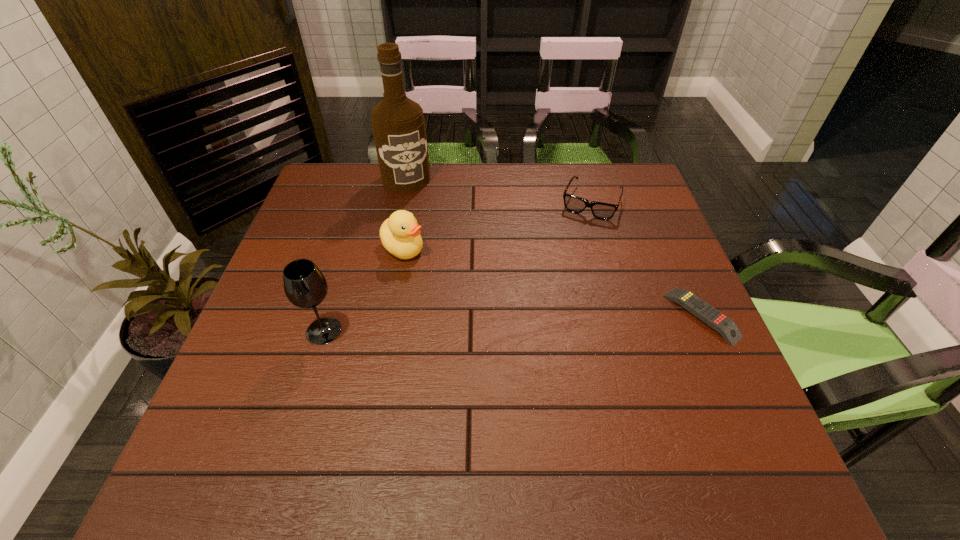
At what (x,y) coordinates should I click in order to perform the action: click on free space that is in between the tallest object and the shortest object. Please return your answer as a coordinate pair (x, y). Looking at the image, I should click on (554, 247).

Locate which object is the third closest to the tallest object. Please provide its 2D coordinates. Your answer should be formatted as a tuple, i.e. [(x, y)], where the tuple contains the x and y coordinates of a point satisfying the conditions above.

[(305, 286)]

Choose which object is the nearest neighbor to the duck. Please provide its 2D coordinates. Your answer should be formatted as a tuple, i.e. [(x, y)], where the tuple contains the x and y coordinates of a point satisfying the conditions above.

[(305, 286)]

You are a GUI agent. You are given a task and a screenshot of the screen. Output one action in this format:
    pyautogui.click(x=<x>, y=<y>)
    Task: Click on the vacant space that satisfies the following two spatial constraints: 1. on the back side of the wineglass; 2. on the right side of the shortest object
    This screenshot has height=540, width=960.
    Given the screenshot: What is the action you would take?
    pyautogui.click(x=328, y=315)

This screenshot has height=540, width=960. I want to click on vacant space that satisfies the following two spatial constraints: 1. on the back side of the fourth tallest object; 2. on the right side of the third tallest object, so click(x=412, y=202).

This screenshot has width=960, height=540. Find the location of `free location that satisfies the following two spatial constraints: 1. on the front side of the sunglasses; 2. on the left side of the tallest object`. free location that satisfies the following two spatial constraints: 1. on the front side of the sunglasses; 2. on the left side of the tallest object is located at coordinates (401, 202).

Identify the location of vacant space that satisfies the following two spatial constraints: 1. on the back side of the shortest object; 2. on the right side of the fourth shortest object. (328, 315).